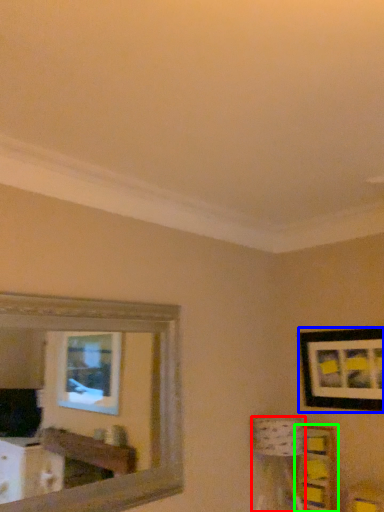
Question: Based on their relative distances, which object is farther from table lamp (highlighted by a red box)? Choose from picture frame (highlighted by a blue box) and shelf (highlighted by a green box).

Choices:
 (A) picture frame
 (B) shelf

Answer: (A)